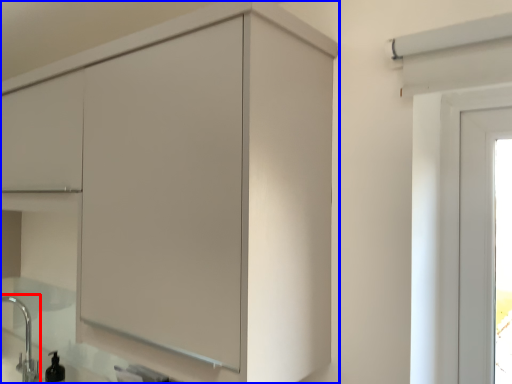
Question: Which of the following is the closest to the observer, faucet (highlighted by a red box) or cupboard (highlighted by a blue box)?

Choices:
 (A) faucet
 (B) cupboard

Answer: (B)